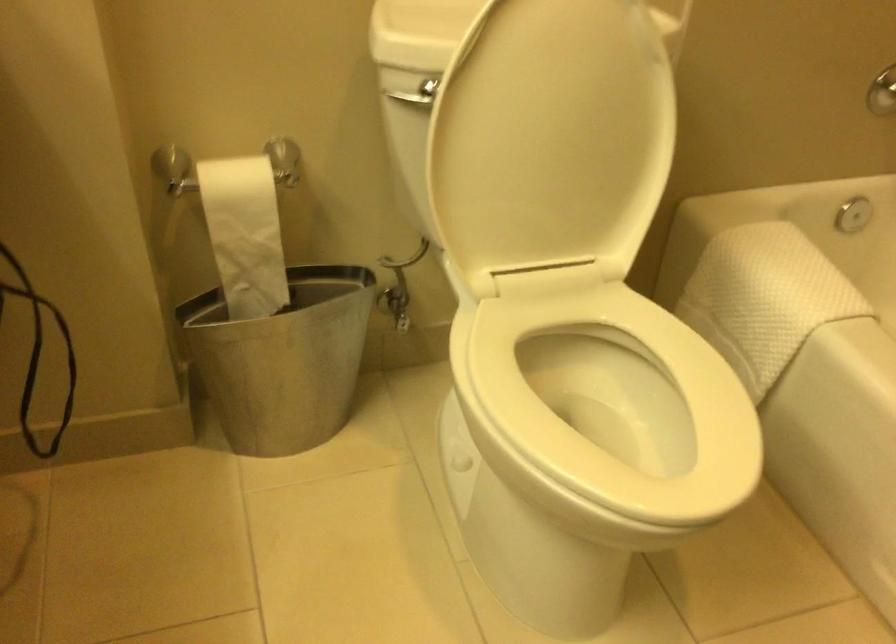
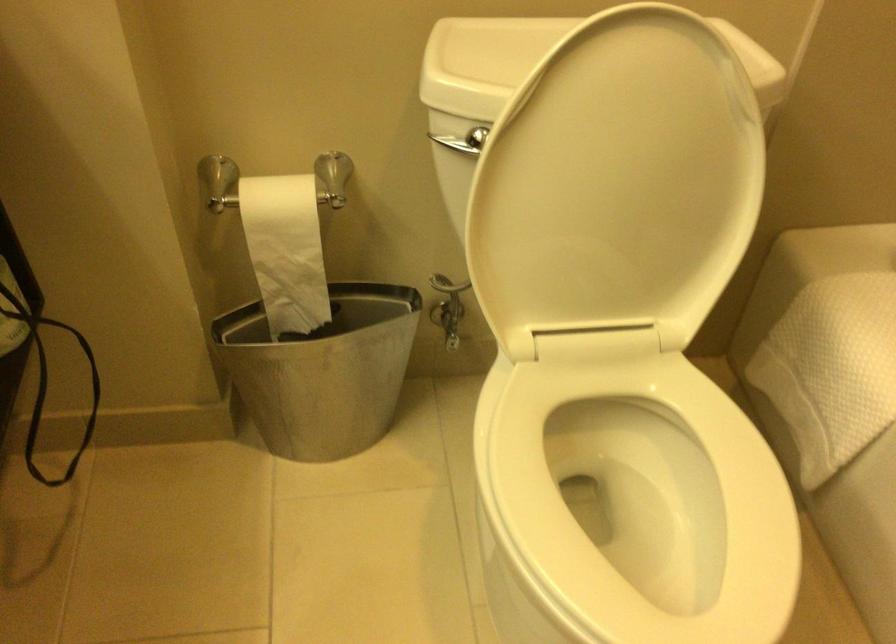
Locate, in the second image, the point that corresponds to the point at 398,308 in the first image.

(449, 325)